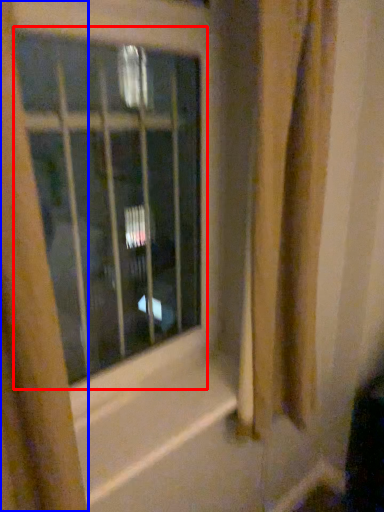
Question: Which point is closer to the camera, window (highlighted by a red box) or curtain (highlighted by a blue box)?

Choices:
 (A) window
 (B) curtain

Answer: (B)